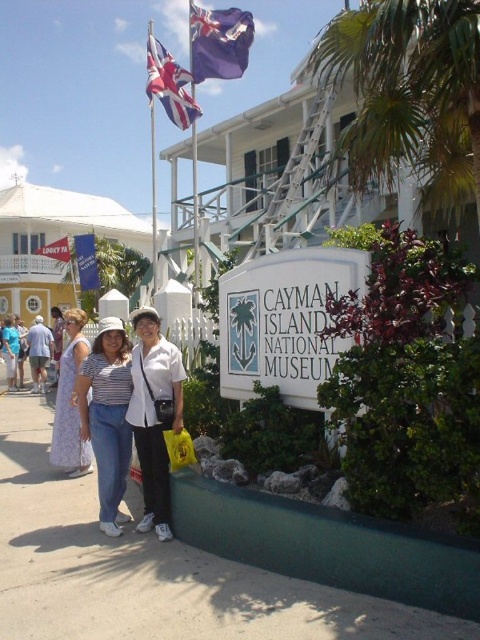
Looking at this image, can you confirm if striped cotton shirt at center is taller than yellow plastic bag at lower center?

Correct, striped cotton shirt at center is much taller as yellow plastic bag at lower center.

Can you confirm if striped cotton shirt at center is shorter than yellow plastic bag at lower center?

No, striped cotton shirt at center is not shorter than yellow plastic bag at lower center.

Which is behind, point (110, 524) or point (177, 456)?

Positioned behind is point (110, 524).

I want to click on striped cotton shirt at center, so click(108, 417).

Can you confirm if union jack flag at upper left is thinner than yellow plastic bag at lower center?

Incorrect, union jack flag at upper left's width is not less than yellow plastic bag at lower center's.

The height and width of the screenshot is (640, 480). I want to click on union jack flag at upper left, so click(x=169, y=84).

Is point (162, 61) behind point (86, 237)?

No.

Does union jack flag at upper left have a greater width compared to blue fabric flag at upper left?

Indeed, union jack flag at upper left has a greater width compared to blue fabric flag at upper left.

Describe the element at coordinates (169, 84) in the screenshot. The image size is (480, 640). I see `union jack flag at upper left` at that location.

What are the coordinates of `union jack flag at upper left` in the screenshot? It's located at (169, 84).